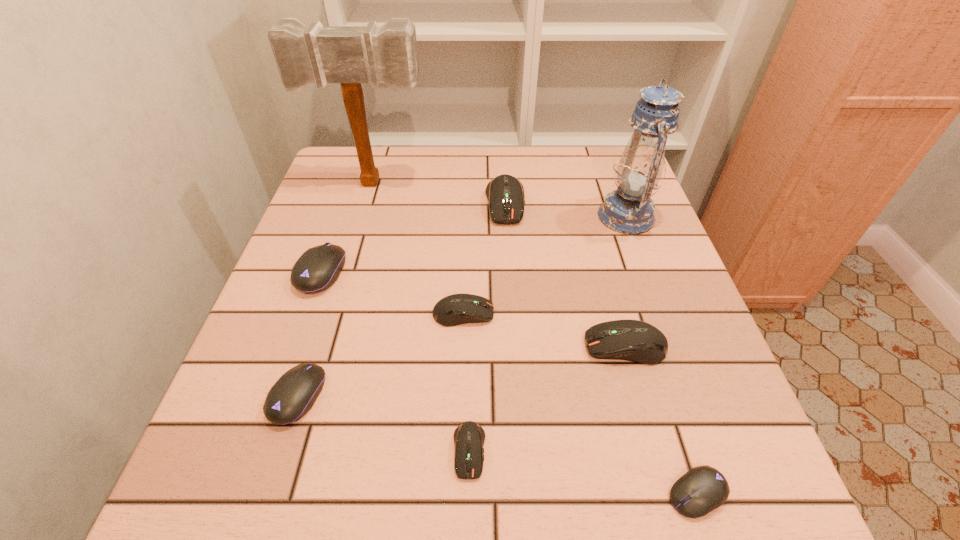
At what (x,y) coordinates should I click in order to perform the action: click on empty space between the second biggest black computer mouse and the smallest black computer mouse. Please return your answer as a coordinate pair (x, y). Image resolution: width=960 pixels, height=540 pixels. Looking at the image, I should click on (497, 445).

You are a GUI agent. You are given a task and a screenshot of the screen. Output one action in this format:
    pyautogui.click(x=<x>, y=<y>)
    Task: Click on the vacant space that's between the second nearest black computer mouse and the nearest dark computer equipment
    
    Given the screenshot: What is the action you would take?
    pyautogui.click(x=384, y=423)

At what (x,y) coordinates should I click in order to perform the action: click on free space between the rightmost black computer mouse and the smallest dark computer equipment. Please return your answer as a coordinate pair (x, y). Looking at the image, I should click on (583, 472).

Find the location of a particular element. This screenshot has height=540, width=960. vacant space that's between the second biggest black computer mouse and the second biggest dark computer equipment is located at coordinates (462, 371).

I want to click on free space that is in between the second farthest dark computer equipment and the lantern, so click(x=544, y=265).

Locate an element on the screen. The height and width of the screenshot is (540, 960). vacant point located between the third farthest dark computer equipment and the second farthest black computer mouse is located at coordinates (462, 371).

Locate an element on the screen. The width and height of the screenshot is (960, 540). vacant space that's between the second nearest dark computer equipment and the smallest dark computer equipment is located at coordinates (547, 399).

Select which object is the second closest to the fifth nearest object. Please provide its 2D coordinates. Your answer should be formatted as a tuple, i.e. [(x, y)], where the tuple contains the x and y coordinates of a point satisfying the conditions above.

[(293, 395)]

In order to click on object identified as the fifth closest to the third tallest object in this screenshot , I will do `click(318, 268)`.

Image resolution: width=960 pixels, height=540 pixels. I want to click on computer mouse identified as the closest to the smallest dark computer equipment, so [456, 309].